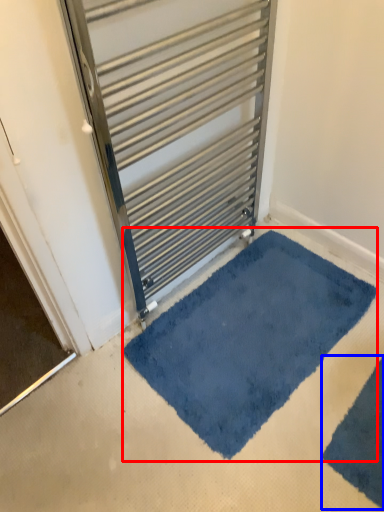
Question: Which object is closer to the camera taking this photo, bath mat (highlighted by a red box) or bath mat (highlighted by a blue box)?

Choices:
 (A) bath mat
 (B) bath mat

Answer: (B)